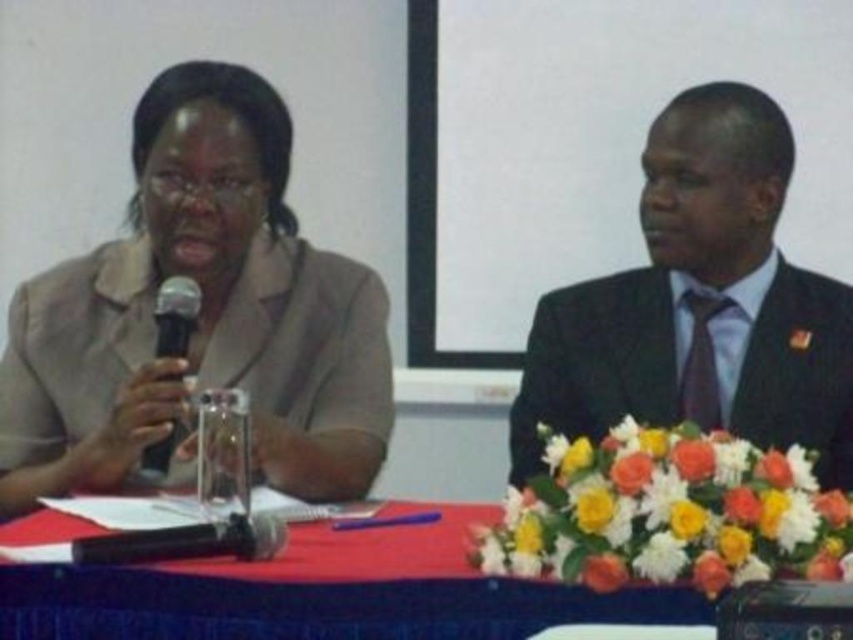
Which of these two, matte beige blazer at left or black suit at right, stands shorter?

With less height is black suit at right.

Between matte beige blazer at left and black suit at right, which one appears on the left side from the viewer's perspective?

From the viewer's perspective, matte beige blazer at left appears more on the left side.

Between point (4, 500) and point (805, 346), which one is positioned in front?

Positioned in front is point (4, 500).

Find the location of a particular element. The width and height of the screenshot is (853, 640). matte beige blazer at left is located at coordinates (199, 314).

Which is below, matte beige blazer at left or black matte microphone at left?

Positioned lower is black matte microphone at left.

Find the location of a particular element. matte beige blazer at left is located at coordinates (199, 314).

You are a GUI agent. You are given a task and a screenshot of the screen. Output one action in this format:
    pyautogui.click(x=<x>, y=<y>)
    Task: Click on the matte beige blazer at left
    
    Given the screenshot: What is the action you would take?
    pyautogui.click(x=199, y=314)

Which is in front, point (457, 624) or point (173, 332)?

Point (457, 624) is more forward.

Does red fabric table at center appear over black matte microphone at left?

Incorrect, red fabric table at center is not positioned above black matte microphone at left.

Describe the element at coordinates (325, 592) in the screenshot. I see `red fabric table at center` at that location.

Find the location of a particular element. Image resolution: width=853 pixels, height=640 pixels. red fabric table at center is located at coordinates point(325,592).